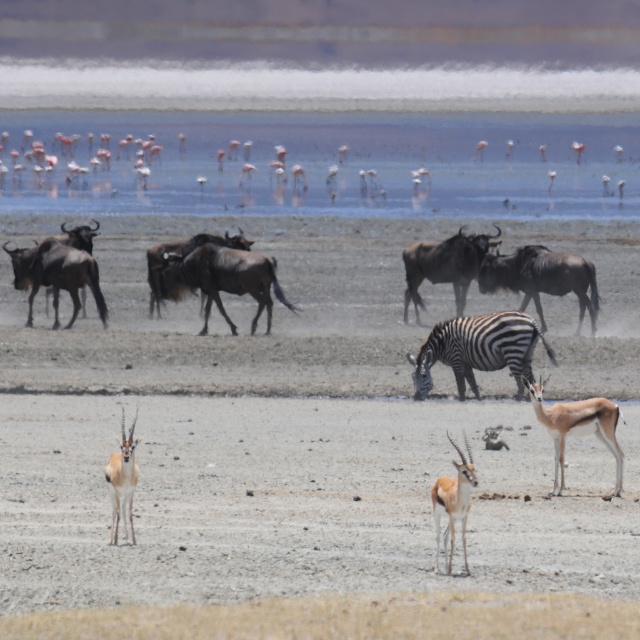
You are a photographer standing at the origin point of the coordinate system. You want to take a photo of the black and white striped zebra at center. What are the coordinates where you should aim your camera?

The coordinates to aim your camera are at point 0.547 on the x axis and 0.748 on the y axis, which corresponds to the position of the black and white striped zebra at center.

In the wildlife scene, there are two antelopes visible. The first is a light brown fur antelope at lower center and the second is a shiny brown antelope at center. From the perspective of an observer looking at the image, which antelope is located to the left of the other?

The light brown fur antelope at lower center is positioned on the right side of the shiny brown antelope at center, so the shiny brown antelope at center is to the left of the light brown fur antelope at lower center.

You are a wildlife photographer trying to capture a photo of both the black and white striped zebra at center and the brown glossy antelope at center. Based on their positions, which animal should you adjust your camera to focus on first if you want to include both in the same frame?

The brown glossy antelope at center is positioned to the left of the black and white striped zebra at center, so you should focus on the brown glossy antelope at center first to ensure both are in the frame.